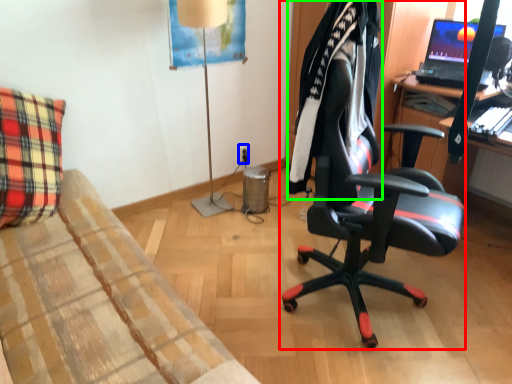
Question: Based on their relative distances, which object is nearer to chair (highlighted by a red box)? Choose from power outlet (highlighted by a blue box) and clothing (highlighted by a green box).

Choices:
 (A) power outlet
 (B) clothing

Answer: (B)